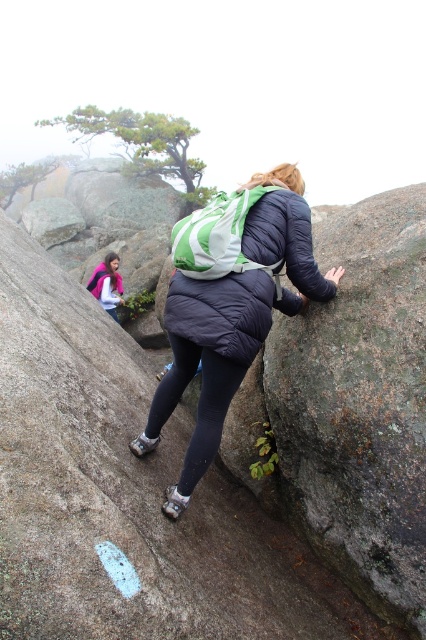
Which of these two, rough granite boulder at center or matte blue down jacket at center, stands taller?

rough granite boulder at center is taller.

Does point (215, 548) come closer to viewer compared to point (224, 285)?

No, (215, 548) is behind (224, 285).

Where is `rough granite boulder at center`? rough granite boulder at center is located at coordinates (124, 493).

Who is positioned more to the right, matte blue jacket at center or matte blue down jacket at center?

From the viewer's perspective, matte blue down jacket at center appears more on the right side.

Which is below, matte blue jacket at center or matte blue down jacket at center?

matte blue jacket at center is below.

At what (x,y) coordinates should I click in order to perform the action: click on matte blue jacket at center. Please return your answer as a coordinate pair (x, y). This screenshot has width=426, height=640. Looking at the image, I should click on (233, 321).

The width and height of the screenshot is (426, 640). Find the location of `matte blue down jacket at center`. matte blue down jacket at center is located at coordinates (227, 310).

Find the location of `matte blue down jacket at center`. matte blue down jacket at center is located at coordinates (227, 310).